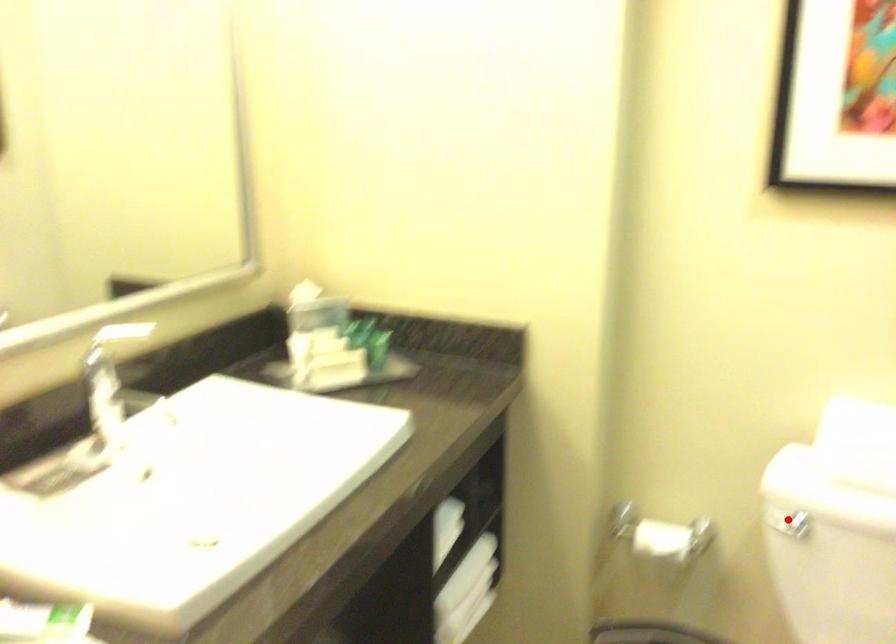
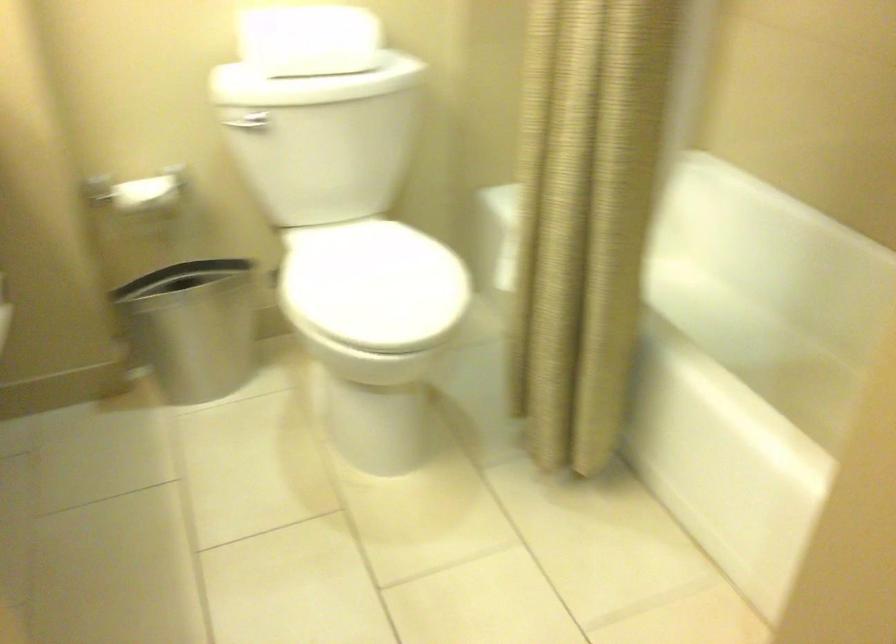
Question: I am providing you with two images of the same scene from different viewpoints. Given a red point in image1, look at the same physical point in image2. Is it:

Choices:
 (A) Closer to the viewpoint
 (B) Farther from the viewpoint

Answer: (B)